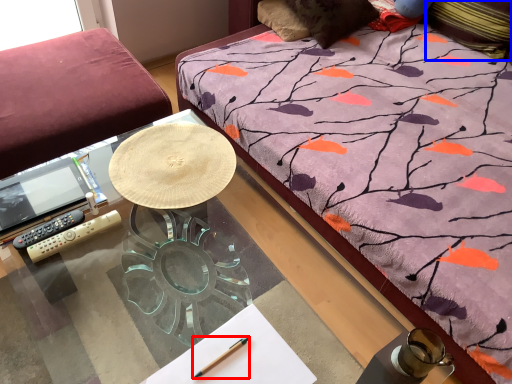
Question: Which object appears farthest to the camera in this image, pen (highlighted by a red box) or pillow (highlighted by a blue box)?

Choices:
 (A) pen
 (B) pillow

Answer: (B)